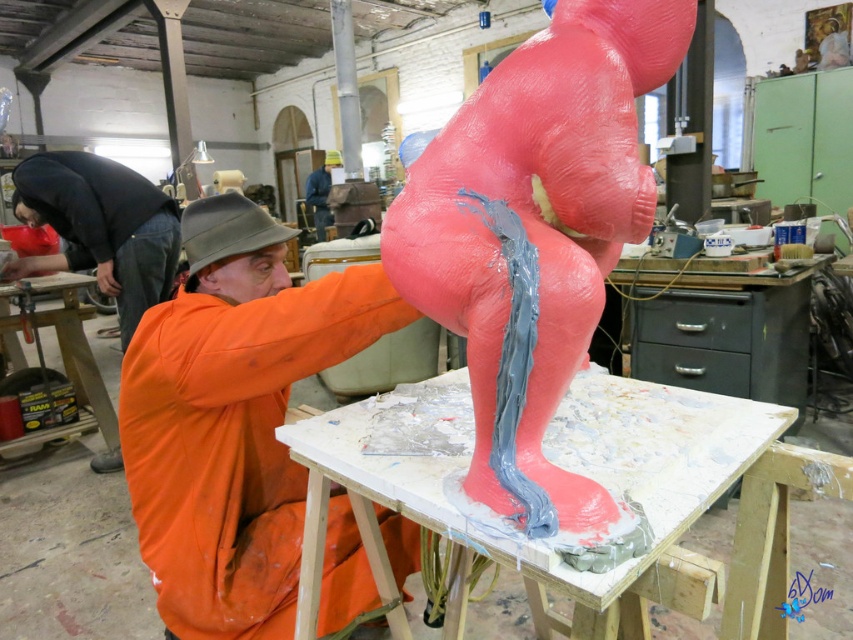
Is rubber-like pink sculpture at center taller than orange matte jacket at center?

In fact, rubber-like pink sculpture at center may be shorter than orange matte jacket at center.

Consider the image. Is rubber-like pink sculpture at center positioned behind orange matte jacket at center?

No, rubber-like pink sculpture at center is in front of orange matte jacket at center.

Measure the distance between point (558, 67) and camera.

Point (558, 67) and camera are 31.10 inches apart.

Identify the location of rubber-like pink sculpture at center. This screenshot has width=853, height=640. (535, 236).